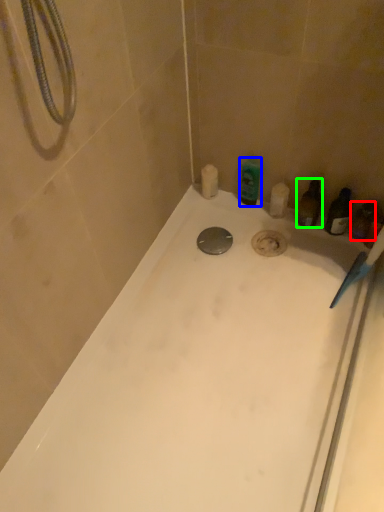
Question: Considering the real-world distances, which object is closest to toiletry (highlighted by a red box)? toiletry (highlighted by a blue box) or toiletry (highlighted by a green box).

Choices:
 (A) toiletry
 (B) toiletry

Answer: (B)